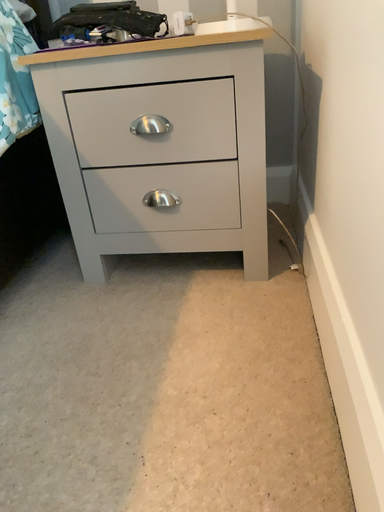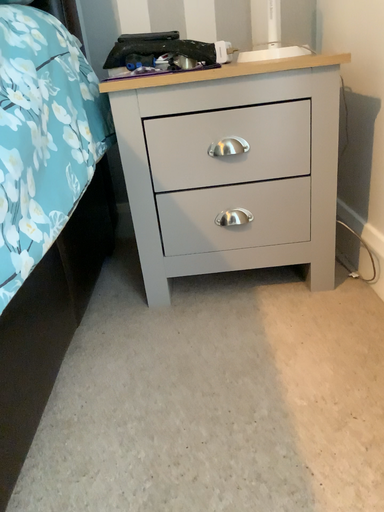
Question: How did the camera likely rotate when shooting the video?

Choices:
 (A) rotated left
 (B) rotated right

Answer: (B)